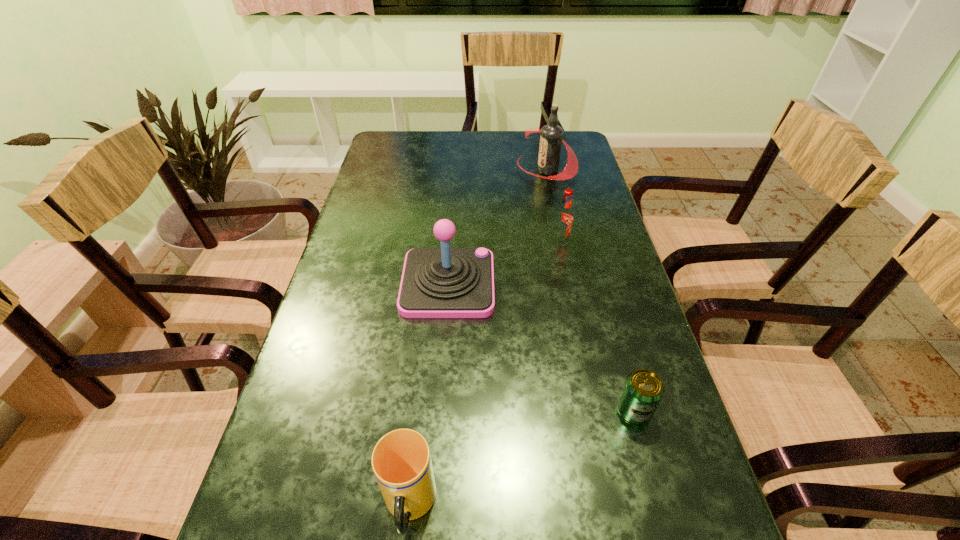
Locate an element on the screen. The height and width of the screenshot is (540, 960). free space located 0.320m on the label of the farther root beer is located at coordinates (421, 170).

What are the coordinates of `free spot located forward from the base of the joystick` in the screenshot? It's located at (530, 284).

At what (x,y) coordinates should I click in order to perform the action: click on blank space located on the left of the nearer root beer. Please return your answer as a coordinate pair (x, y). Looking at the image, I should click on (468, 241).

Locate an element on the screen. This screenshot has height=540, width=960. blank area located 0.080m on the left of the beer can is located at coordinates (574, 411).

In order to click on object that is at the far edge in this screenshot , I will do `click(551, 138)`.

At what (x,y) coordinates should I click in order to perform the action: click on beer can that is at the right edge. Please return your answer as a coordinate pair (x, y). Looking at the image, I should click on click(x=643, y=390).

This screenshot has width=960, height=540. Find the location of `object at the far right corner`. object at the far right corner is located at coordinates (551, 138).

This screenshot has width=960, height=540. I want to click on vacant region at the far edge, so click(467, 148).

In the image, there is a desktop. At what (x,y) coordinates should I click in order to perform the action: click on free space at the left edge. Please return your answer as a coordinate pair (x, y). The height and width of the screenshot is (540, 960). Looking at the image, I should click on (310, 332).

In the image, there is a desktop. Where is `vacant space at the right edge`? vacant space at the right edge is located at coordinates (598, 390).